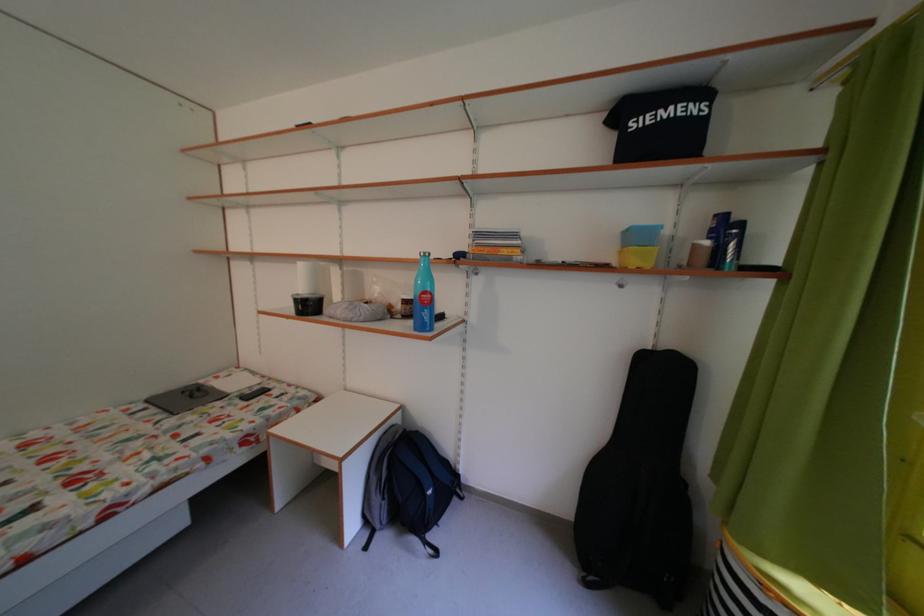
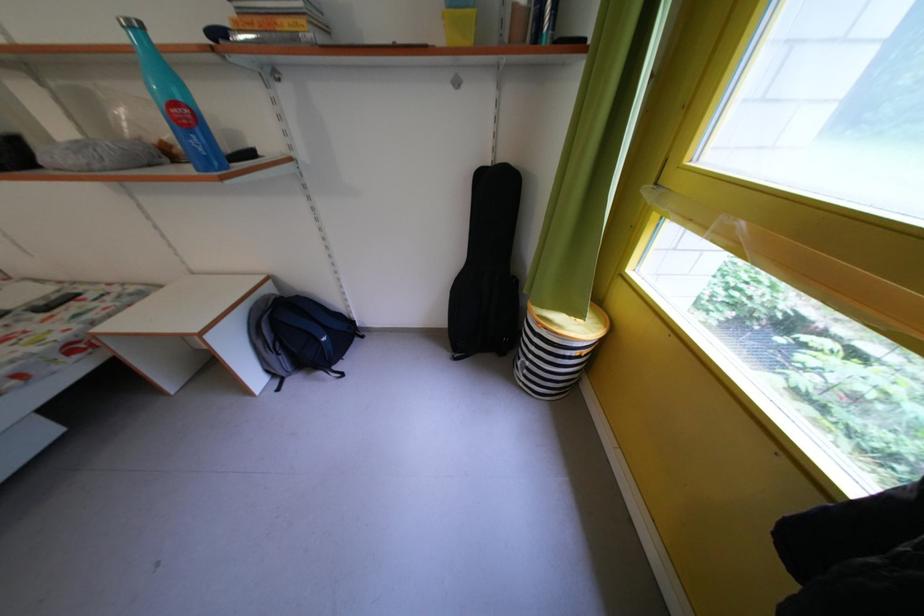
Locate, in the second image, the point that corresponds to pixel 407 424 in the first image.

(278, 296)